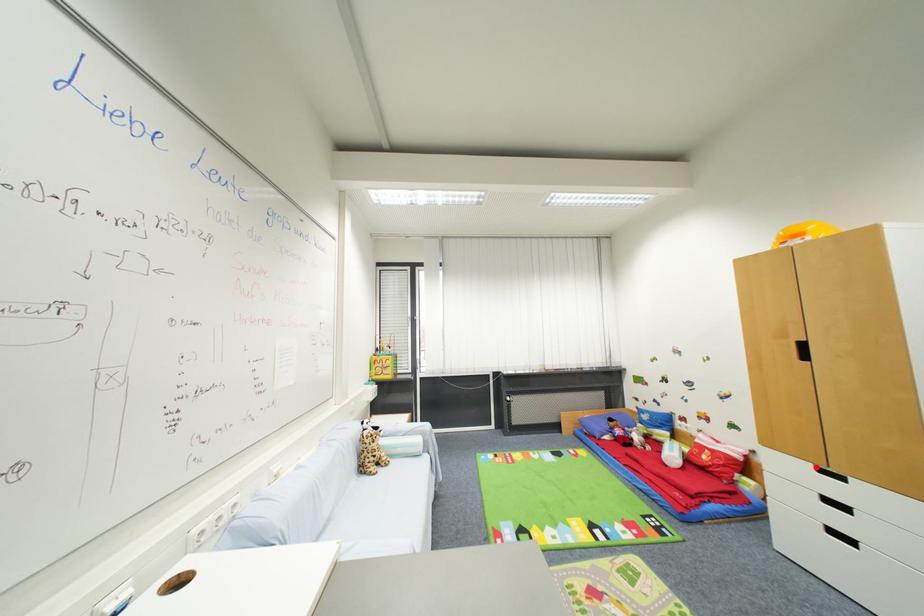
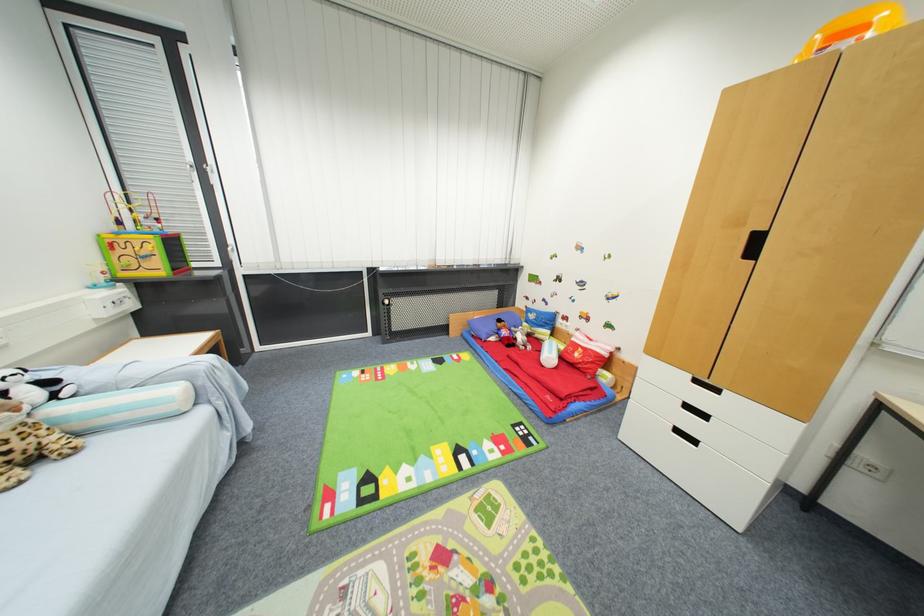
Question: I am providing you with two images of the same scene from different viewpoints. Given a red point in image1, look at the same physical point in image2. Is it:

Choices:
 (A) Closer to the viewpoint
 (B) Farther from the viewpoint

Answer: (B)